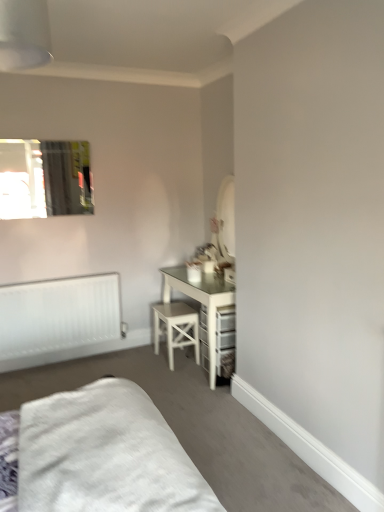
Question: Is clear glass mirror at upper left bigger or smaller than white matte radiator at lower left?

Choices:
 (A) big
 (B) small

Answer: (B)

Question: Is clear glass mirror at upper left spatially inside white matte radiator at lower left, or outside of it?

Choices:
 (A) inside
 (B) outside

Answer: (B)

Question: Which is farther from the white matte radiator at lower left?

Choices:
 (A) white wood stool at center
 (B) clear glass mirror at upper left
 (C) white soft bed at lower left

Answer: (C)

Question: Based on their relative distances, which object is nearer to the white soft bed at lower left?

Choices:
 (A) clear glass mirror at upper left
 (B) white matte radiator at lower left
 (C) white wood stool at center

Answer: (C)